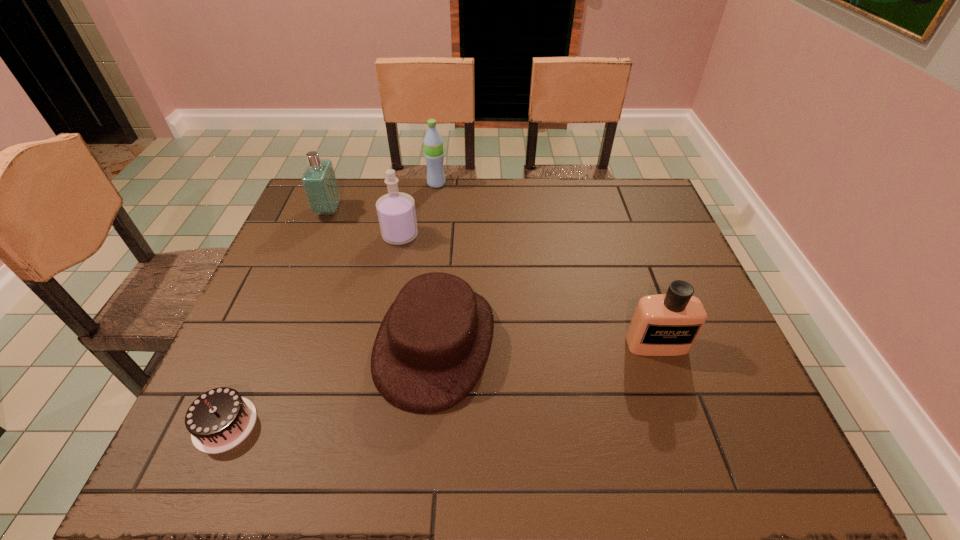
Image resolution: width=960 pixels, height=540 pixels. I want to click on free spot between the second perfume from right to left and the shortest object, so click(313, 330).

What are the coordinates of `vacant space that's between the third farthest object and the farthest object` in the screenshot? It's located at (419, 210).

The width and height of the screenshot is (960, 540). What are the coordinates of `free space between the rightmost perfume and the fifth tallest object` in the screenshot? It's located at (546, 344).

What are the coordinates of `free spot between the nearest perfume and the second farthest object` in the screenshot? It's located at (492, 278).

Select which object is the fourth closest to the hat. Please provide its 2D coordinates. Your answer should be formatted as a tuple, i.e. [(x, y)], where the tuple contains the x and y coordinates of a point satisfying the conditions above.

[(319, 182)]

Locate which object is the fifth closest to the fifth tallest object. Please provide its 2D coordinates. Your answer should be formatted as a tuple, i.e. [(x, y)], where the tuple contains the x and y coordinates of a point satisfying the conditions above.

[(433, 143)]

Locate an element on the screen. The width and height of the screenshot is (960, 540). perfume that can be found as the closest to the second perfume from left to right is located at coordinates (319, 182).

Where is `the closest perfume to the chocolate cake`? the closest perfume to the chocolate cake is located at coordinates (396, 212).

Locate an element on the screen. The image size is (960, 540). vacant area in the image that satisfies the following two spatial constraints: 1. on the front label of the second shortest object; 2. on the left side of the leftmost perfume is located at coordinates (275, 343).

What are the coordinates of `free space that satisfies the following two spatial constraints: 1. on the front label of the farthest perfume; 2. on the back side of the second perfume from left to right` in the screenshot? It's located at (319, 235).